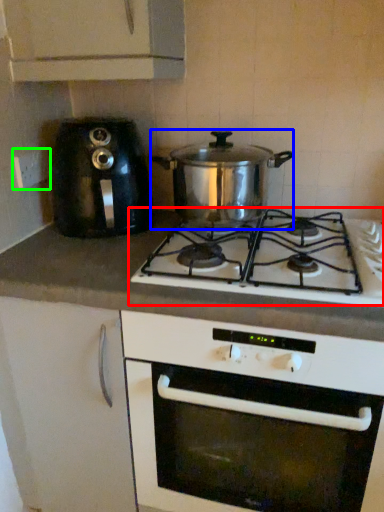
Question: Which is nearer to the gas stove (highlighted by a red box)? kitchen appliance (highlighted by a blue box) or electric outlet (highlighted by a green box).

Choices:
 (A) kitchen appliance
 (B) electric outlet

Answer: (A)